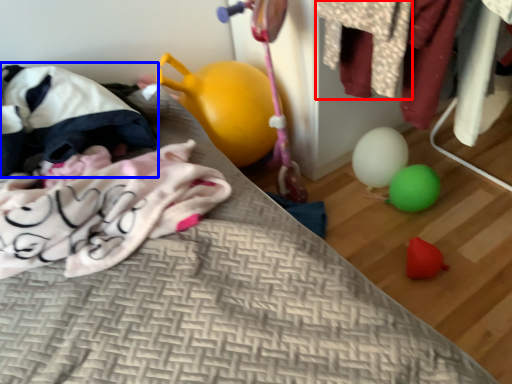
Question: Which point is closer to the camera, clothing (highlighted by a red box) or bean bag chair (highlighted by a blue box)?

Choices:
 (A) clothing
 (B) bean bag chair

Answer: (A)